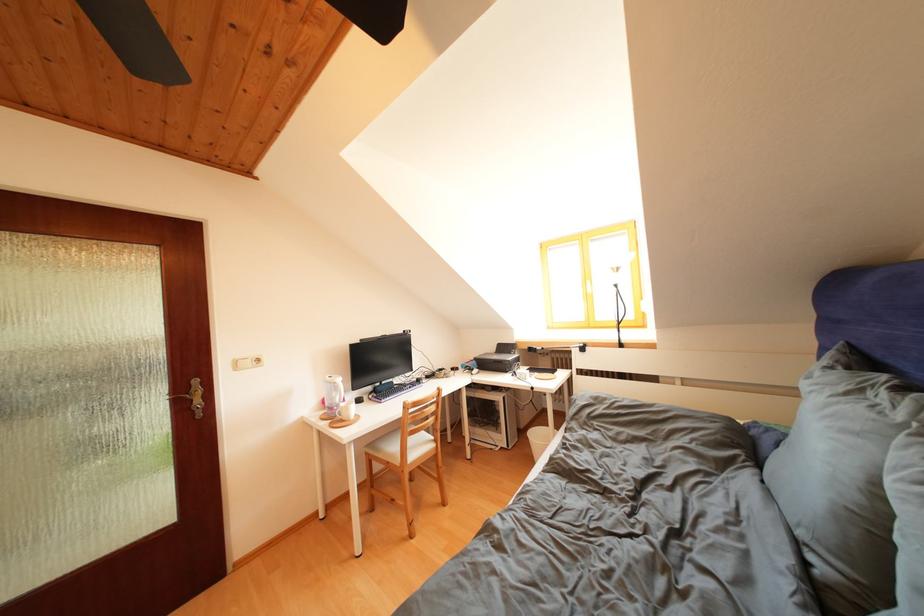
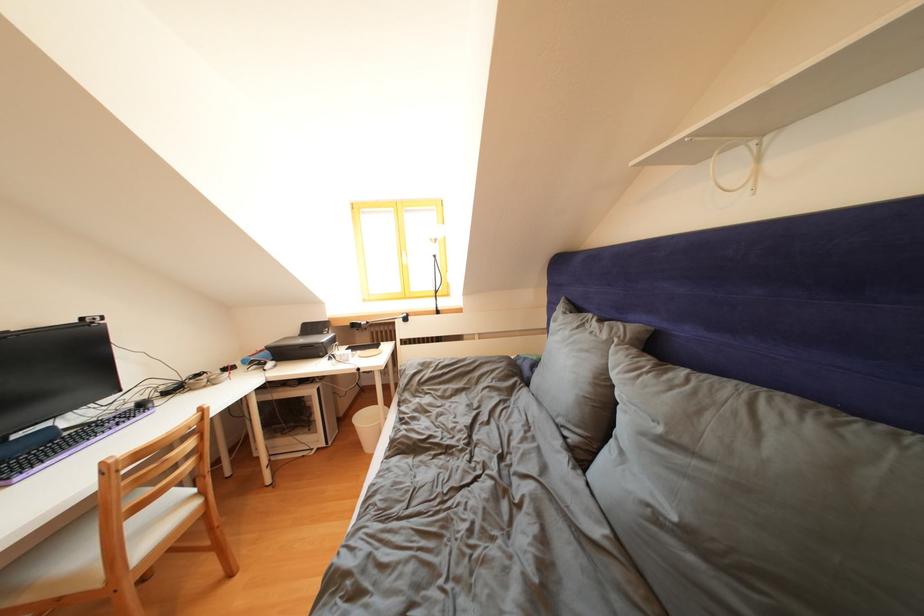
Find the pixel in the second image that matches (x=512, y=353) in the first image.

(319, 333)